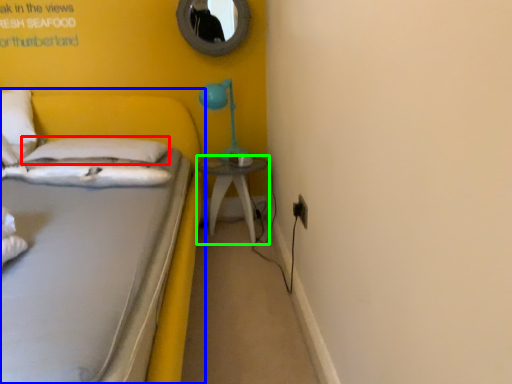
Question: Considering the real-world distances, which object is farthest from pillow (highlighted by a red box)? bed (highlighted by a blue box) or nightstand (highlighted by a green box)?

Choices:
 (A) bed
 (B) nightstand

Answer: (B)